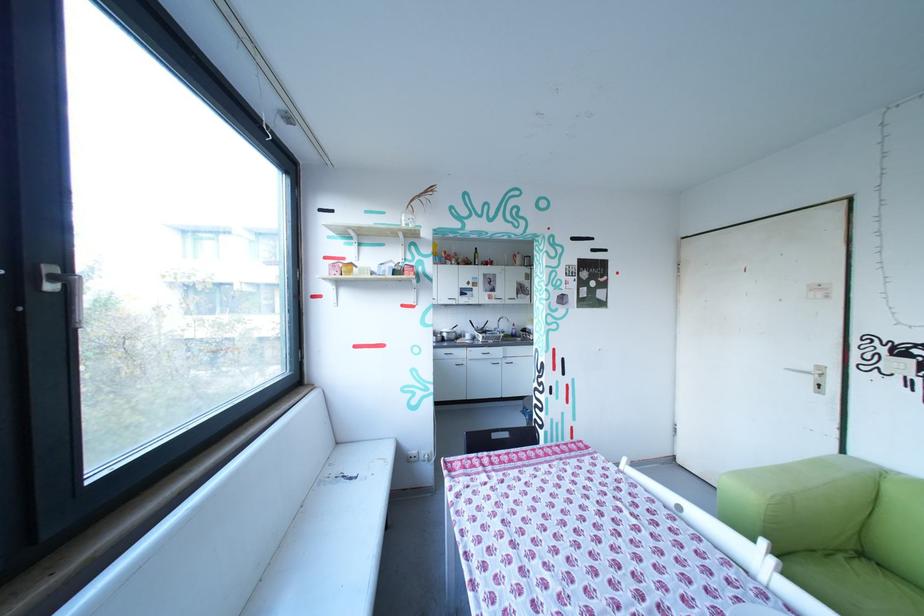
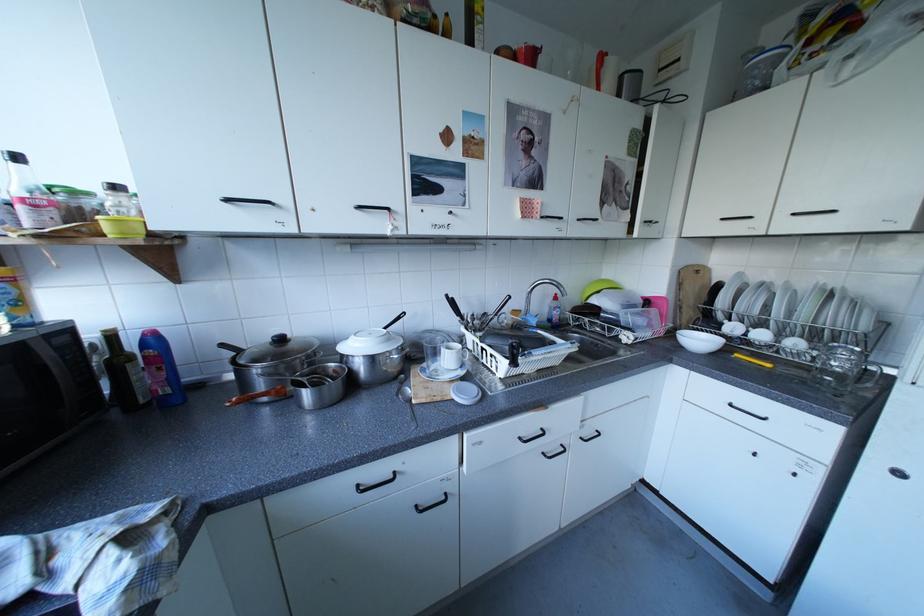
The point at [524,330] is marked in the first image. Where is the corresponding point in the second image?

(558, 310)